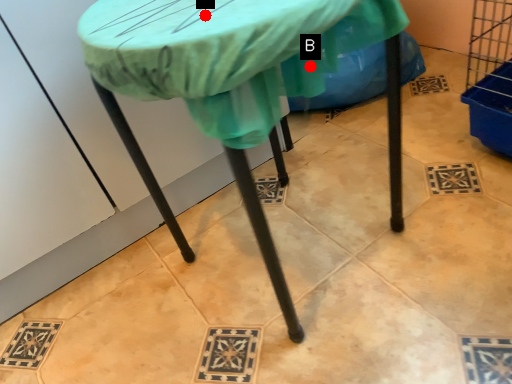
Question: Two points are circled on the image, labeled by A and B beside each circle. Which point is closer to the camera?

Choices:
 (A) A is closer
 (B) B is closer

Answer: (A)